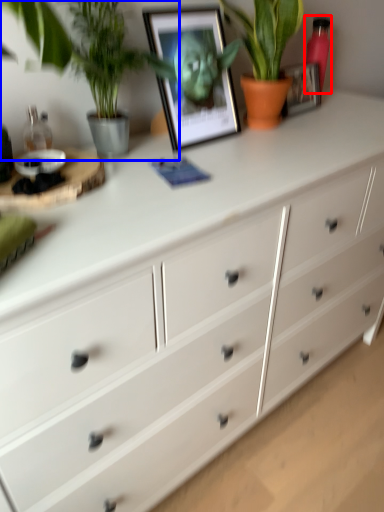
Question: Which object appears closest to the camera in this image, bottle (highlighted by a red box) or houseplant (highlighted by a blue box)?

Choices:
 (A) bottle
 (B) houseplant

Answer: (B)